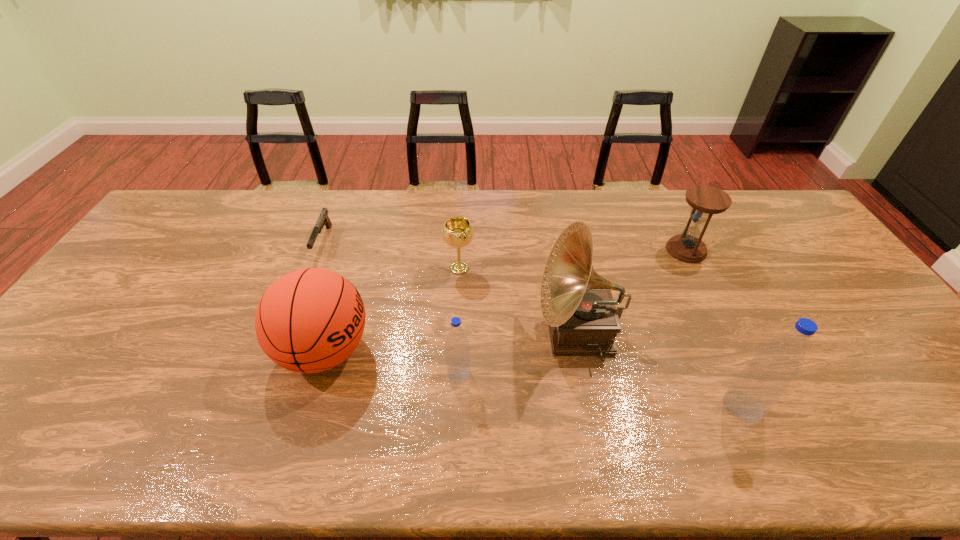
This screenshot has width=960, height=540. Find the location of `the farther water bottle`. the farther water bottle is located at coordinates (457, 354).

You are a GUI agent. You are given a task and a screenshot of the screen. Output one action in this format:
    pyautogui.click(x=<x>, y=<y>)
    Task: Click on the left water bottle
    The width and height of the screenshot is (960, 540).
    Given the screenshot: What is the action you would take?
    pyautogui.click(x=457, y=354)

In order to click on the taller water bottle in this screenshot , I will do `click(762, 382)`.

At what (x,y) coordinates should I click in order to perform the action: click on the nearer water bottle. Please return your answer as a coordinate pair (x, y). The height and width of the screenshot is (540, 960). Looking at the image, I should click on (762, 382).

Where is `gun`? Image resolution: width=960 pixels, height=540 pixels. gun is located at coordinates (323, 219).

Find the location of a particular element. hourglass is located at coordinates (705, 200).

The image size is (960, 540). I want to click on the second shortest object, so click(457, 232).

This screenshot has height=540, width=960. I want to click on phonograph record, so click(x=577, y=304).

Locate an element on the screen. The image size is (960, 540). basketball is located at coordinates (310, 320).

The image size is (960, 540). Find the location of `vacant area situated on the back of the farther water bottle`. vacant area situated on the back of the farther water bottle is located at coordinates (462, 303).